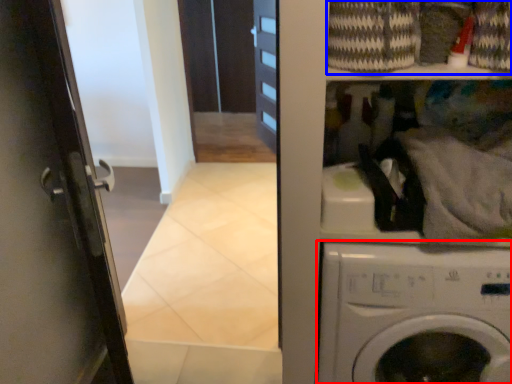
Question: Which point is closer to the camera, washing machine (highlighted by a red box) or laundry (highlighted by a blue box)?

Choices:
 (A) washing machine
 (B) laundry

Answer: (B)